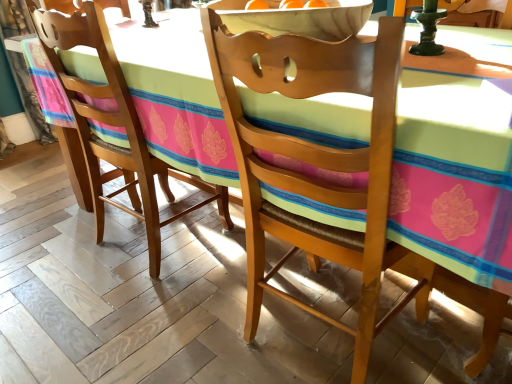
The width and height of the screenshot is (512, 384). I want to click on matte wood chair at lower left, acting as the first chair starting from the left, so click(x=114, y=126).

This screenshot has width=512, height=384. What do you see at coordinates (114, 126) in the screenshot?
I see `matte wood chair at lower left, acting as the first chair starting from the left` at bounding box center [114, 126].

At what (x,y) coordinates should I click in order to perform the action: click on wooden chair at center, the 1th chair viewed from the right. Please return your answer as a coordinate pair (x, y). Image resolution: width=512 pixels, height=384 pixels. Looking at the image, I should click on (317, 163).

What do you see at coordinates (317, 163) in the screenshot? I see `wooden chair at center, the 1th chair viewed from the right` at bounding box center [317, 163].

Identify the location of matte wood chair at lower left, acting as the first chair starting from the left. This screenshot has width=512, height=384. (114, 126).

Considering the relative positions of wooden chair at center, the 2th chair viewed from the left, and matte wood chair at lower left, acting as the first chair starting from the left, in the image provided, is wooden chair at center, the 2th chair viewed from the left, to the left or to the right of matte wood chair at lower left, acting as the first chair starting from the left,?

Clearly, wooden chair at center, the 2th chair viewed from the left, is on the right of matte wood chair at lower left, acting as the first chair starting from the left, in the image.

Considering their positions, is wooden chair at center, the 2th chair viewed from the left, located in front of or behind matte wood chair at lower left, acting as the first chair starting from the left?

In the image, wooden chair at center, the 2th chair viewed from the left, appears in front of matte wood chair at lower left, acting as the first chair starting from the left.

Is point (359, 321) behind point (187, 178)?

No.

In the scene shown: From the image's perspective, is wooden chair at center, the 2th chair viewed from the left, above or below matte wood chair at lower left, acting as the first chair starting from the left?

From the image's perspective, wooden chair at center, the 2th chair viewed from the left, appears below matte wood chair at lower left, acting as the first chair starting from the left.

From a real-world perspective, does wooden chair at center, the 1th chair viewed from the right, stand above matte wood chair at lower left, acting as the first chair starting from the left?

No, from a real-world perspective, wooden chair at center, the 1th chair viewed from the right, is not above matte wood chair at lower left, acting as the first chair starting from the left.

Which of these two, wooden chair at center, the 2th chair viewed from the left, or matte wood chair at lower left, the 2th chair in the right-to-left sequence, is wider?

With larger width is matte wood chair at lower left, the 2th chair in the right-to-left sequence.

Is wooden chair at center, the 2th chair viewed from the left, shorter than matte wood chair at lower left, acting as the first chair starting from the left?

Incorrect, the height of wooden chair at center, the 2th chair viewed from the left, does not fall short of that of matte wood chair at lower left, acting as the first chair starting from the left.

Between wooden chair at center, the 2th chair viewed from the left, and matte wood chair at lower left, the 2th chair in the right-to-left sequence, which one has larger size?

matte wood chair at lower left, the 2th chair in the right-to-left sequence, is bigger.

Is wooden chair at center, the 1th chair viewed from the right, situated inside matte wood chair at lower left, acting as the first chair starting from the left, or outside?

wooden chair at center, the 1th chair viewed from the right, is outside matte wood chair at lower left, acting as the first chair starting from the left.

Is wooden chair at center, the 1th chair viewed from the right, next to matte wood chair at lower left, acting as the first chair starting from the left?

There is a gap between wooden chair at center, the 1th chair viewed from the right, and matte wood chair at lower left, acting as the first chair starting from the left.

Is wooden chair at center, the 2th chair viewed from the left, facing towards matte wood chair at lower left, the 2th chair in the right-to-left sequence?

No, wooden chair at center, the 2th chair viewed from the left, is not oriented towards matte wood chair at lower left, the 2th chair in the right-to-left sequence.

Based on the photo, what's the angular difference between wooden chair at center, the 1th chair viewed from the right, and matte wood chair at lower left, acting as the first chair starting from the left,'s facing directions?

There is a 0.000487-degree angle between the facing directions of wooden chair at center, the 1th chair viewed from the right, and matte wood chair at lower left, acting as the first chair starting from the left.

You are a GUI agent. You are given a task and a screenshot of the screen. Output one action in this format:
    pyautogui.click(x=<x>, y=<y>)
    Task: Click on the chair in front of the matte wood chair at lower left, acting as the first chair starting from the left
    
    Given the screenshot: What is the action you would take?
    pyautogui.click(x=317, y=163)

Which is more to the right, matte wood chair at lower left, acting as the first chair starting from the left, or wooden chair at center, the 1th chair viewed from the right?

wooden chair at center, the 1th chair viewed from the right.

Between matte wood chair at lower left, the 2th chair in the right-to-left sequence, and wooden chair at center, the 1th chair viewed from the right, which one is positioned behind?

Positioned behind is matte wood chair at lower left, the 2th chair in the right-to-left sequence.

Considering the positions of point (100, 54) and point (362, 264), is point (100, 54) closer or farther from the camera than point (362, 264)?

Clearly, point (100, 54) is more distant from the camera than point (362, 264).

From the image's perspective, is matte wood chair at lower left, the 2th chair in the right-to-left sequence, over wooden chair at center, the 2th chair viewed from the left?

Yes, from the image's perspective, matte wood chair at lower left, the 2th chair in the right-to-left sequence, is over wooden chair at center, the 2th chair viewed from the left.

From a real-world perspective, between matte wood chair at lower left, acting as the first chair starting from the left, and wooden chair at center, the 1th chair viewed from the right, who is vertically lower?

In real-world perspective, wooden chair at center, the 1th chair viewed from the right, is lower.

In the scene shown: Which of these two, matte wood chair at lower left, acting as the first chair starting from the left, or wooden chair at center, the 1th chair viewed from the right, is wider?

Wider between the two is matte wood chair at lower left, acting as the first chair starting from the left.

Is matte wood chair at lower left, the 2th chair in the right-to-left sequence, taller or shorter than wooden chair at center, the 2th chair viewed from the left?

Considering their sizes, matte wood chair at lower left, the 2th chair in the right-to-left sequence, has less height than wooden chair at center, the 2th chair viewed from the left.

Based on their sizes in the image, would you say matte wood chair at lower left, the 2th chair in the right-to-left sequence, is bigger or smaller than wooden chair at center, the 2th chair viewed from the left?

Clearly, matte wood chair at lower left, the 2th chair in the right-to-left sequence, is larger in size than wooden chair at center, the 2th chair viewed from the left.

Is wooden chair at center, the 1th chair viewed from the right, surrounded by matte wood chair at lower left, the 2th chair in the right-to-left sequence?

Definitely not — wooden chair at center, the 1th chair viewed from the right, is not inside matte wood chair at lower left, the 2th chair in the right-to-left sequence.

Is matte wood chair at lower left, acting as the first chair starting from the left, far from wooden chair at center, the 2th chair viewed from the left?

No, matte wood chair at lower left, acting as the first chair starting from the left, is not far from wooden chair at center, the 2th chair viewed from the left.

Is matte wood chair at lower left, acting as the first chair starting from the left, positioned with its back to wooden chair at center, the 1th chair viewed from the right?

No, matte wood chair at lower left, acting as the first chair starting from the left,'s orientation is not away from wooden chair at center, the 1th chair viewed from the right.

What's the angular difference between matte wood chair at lower left, acting as the first chair starting from the left, and wooden chair at center, the 2th chair viewed from the left,'s facing directions?

The facing directions of matte wood chair at lower left, acting as the first chair starting from the left, and wooden chair at center, the 2th chair viewed from the left, are 0.000487 degrees apart.

I want to click on chair below the matte wood chair at lower left, the 2th chair in the right-to-left sequence (from the image's perspective), so click(317, 163).

Where is `chair that is in front of the matte wood chair at lower left, acting as the first chair starting from the left`? chair that is in front of the matte wood chair at lower left, acting as the first chair starting from the left is located at coordinates (317, 163).

Find the location of a particular element. The image size is (512, 384). chair on the right of matte wood chair at lower left, acting as the first chair starting from the left is located at coordinates (317, 163).